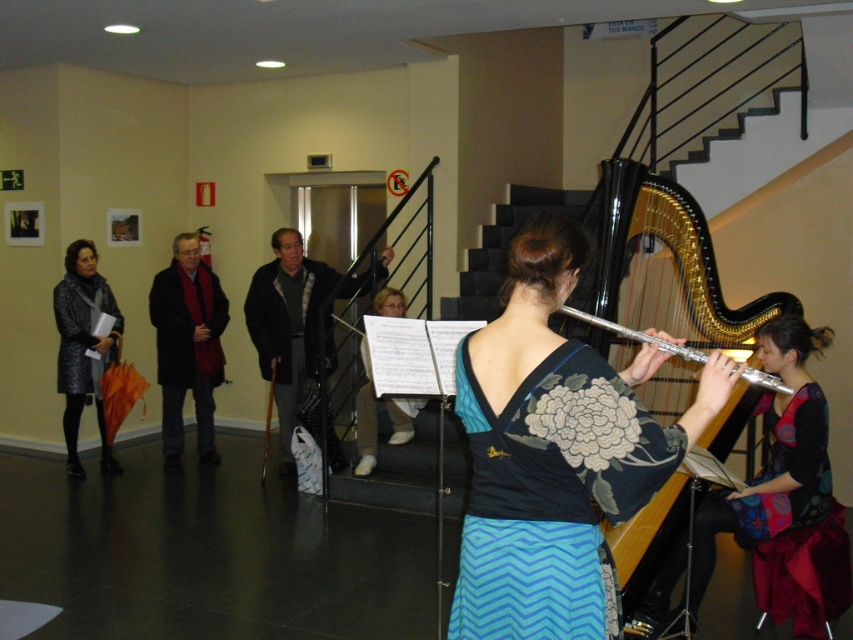
You are a photographer setting up a camera to capture both the black glossy harp at upper right and the multicolored fabric dress at right. Since you want to ensure both are in focus, you need to know which object is taller. Which one is taller?

The multicolored fabric dress at right is taller than the black glossy harp at upper right.

You are a photographer setting up for a photoshoot in the described scene. You need to position a spotlight to the right of both the blue zigzag fabric dress at center and the velvet purple dress at lower right. Is this possible given their current positions?

The blue zigzag fabric dress at center is positioned on the left side of velvet purple dress at lower right, so placing a spotlight to the right of both would be possible as they are aligned horizontally with the blue zigzag fabric dress at center on the left and velvet purple dress at lower right on the right.

You are a photographer standing in the center of the room. You want to take a photo of both the blue zigzag fabric dress at center and the harp on the right. The camera has a maximum focus range of 5 feet. Can you capture both subjects in focus without moving?

The blue zigzag fabric dress at center and the harp on the right are 5.69 feet apart. Since the camera can only focus within 5 feet, the distance between them exceeds the focus range. Therefore, you cannot capture both in focus without moving.